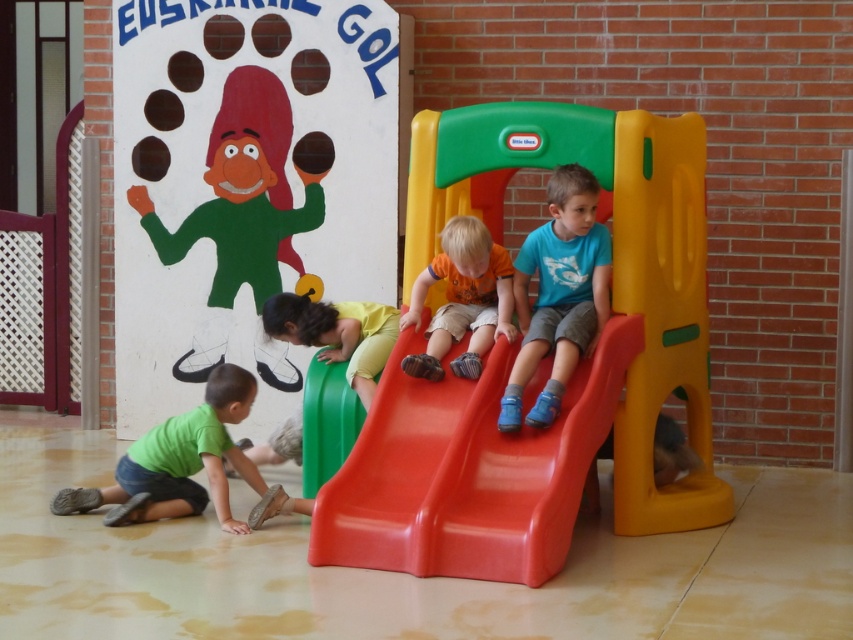
Who is positioned more to the right, red plastic slide at center or blue matte shirt at center?

blue matte shirt at center

Which of these two, red plastic slide at center or blue matte shirt at center, stands taller?

With more height is blue matte shirt at center.

Is point (508, 468) less distant than point (581, 182)?

That is True.

Locate an element on the screen. The image size is (853, 640). red plastic slide at center is located at coordinates (468, 470).

Is blue matte shirt at center bigger than yellow matte slide at lower center?

Yes.

Between blue matte shirt at center and yellow matte slide at lower center, which one appears on the left side from the viewer's perspective?

yellow matte slide at lower center is more to the left.

Is point (592, 336) closer to camera compared to point (349, 365)?

That is True.

Locate an element on the screen. This screenshot has width=853, height=640. blue matte shirt at center is located at coordinates (560, 292).

Is point (448, 308) closer to viewer compared to point (349, 337)?

Yes, it is.

Between orange matte shirt at center and yellow matte slide at lower center, which one is positioned higher?

orange matte shirt at center is above.

Identify the location of orange matte shirt at center. The width and height of the screenshot is (853, 640). (462, 300).

The height and width of the screenshot is (640, 853). I want to click on orange matte shirt at center, so click(462, 300).